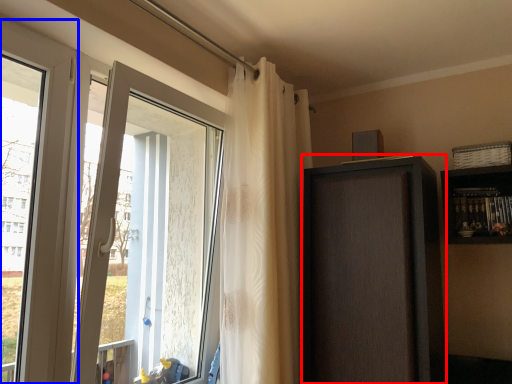
Question: Which point is further to the camera, screen door (highlighted by a red box) or window (highlighted by a blue box)?

Choices:
 (A) screen door
 (B) window

Answer: (A)